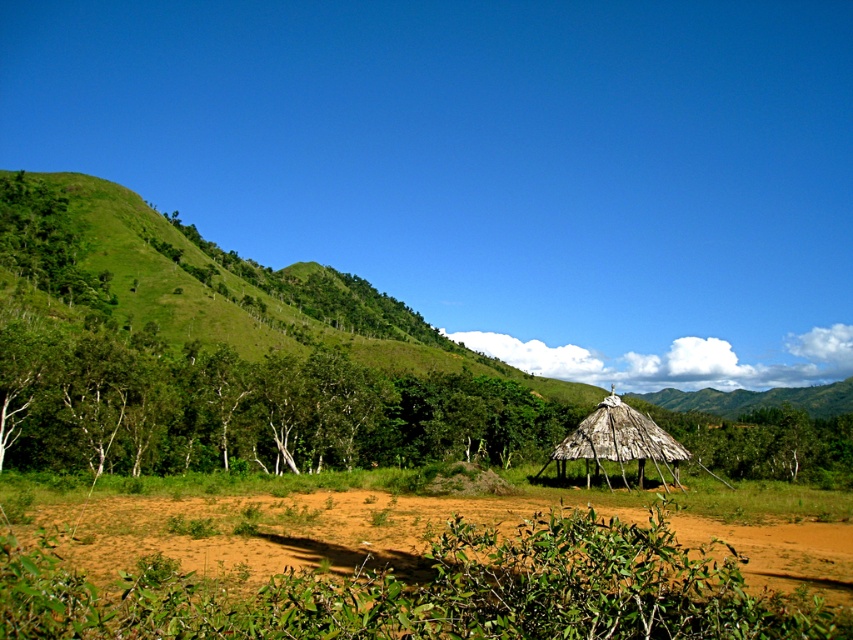
Between point (408, 541) and point (622, 442), which one is positioned in front?

Point (408, 541) is more forward.

Is brown sandy soil at lower center above natural thatch hut at center?

Indeed, brown sandy soil at lower center is positioned over natural thatch hut at center.

Locate an element on the screen. brown sandy soil at lower center is located at coordinates (288, 529).

Does green leafy trees at left have a lesser width compared to brown sandy soil at lower center?

Incorrect, green leafy trees at left's width is not less than brown sandy soil at lower center's.

Between green leafy trees at left and brown sandy soil at lower center, which one has more height?

Standing taller between the two is green leafy trees at left.

The width and height of the screenshot is (853, 640). Find the location of `green leafy trees at left`. green leafy trees at left is located at coordinates (245, 408).

Who is taller, green leafy trees at left or natural thatch hut at center?

green leafy trees at left is taller.

Is point (403, 387) positioned in front of point (672, 460)?

No, it is not.

Identify the location of green leafy trees at left. (245, 408).